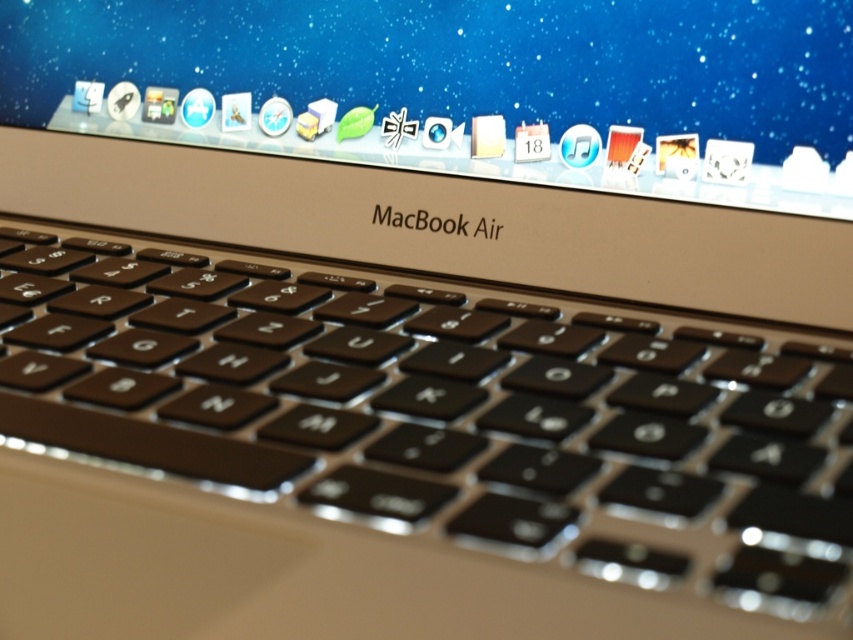
You are setting up a new MacBook Air and need to connect a keyboard. The black matte keyboard at center is currently not attached. Can you place it directly in front of the satin silver macbook air at center without moving the laptop?

The black matte keyboard at center is already positioned in front of the satin silver macbook air at center, so you can leave it there as it is correctly placed.

Based on the photo, you are trying to place a protective cover over both the black matte keyboard at center and the satin silver macbook air at center. Given that the cover must be larger than both objects, what should you consider about their sizes?

The black matte keyboard at center is bigger than the satin silver macbook air at center, so the cover must be larger than the black matte keyboard at center to cover both objects.

You are looking at the MacBook Air screen and keyboard. There are two points marked on the image at coordinates point (65, 232) and point (851, 108). If you were to reach out and touch these points, which one would feel closer to your hand?

Point (65, 232) is further to the viewer than point (851, 108). Therefore, when reaching out to touch them, point (65, 232) would feel closer to your hand since it is nearer to you.